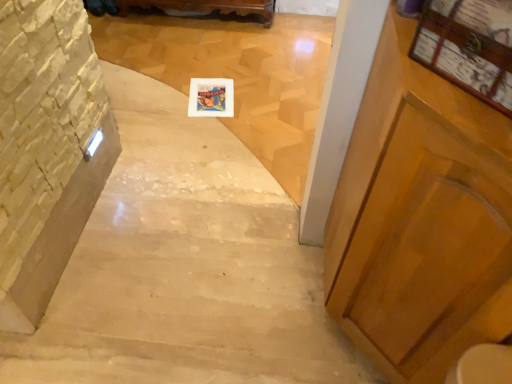
Question: From the image's perspective, is wooden carved bench at upper center below wooden frame at upper right?

Choices:
 (A) no
 (B) yes

Answer: (A)

Question: Is wooden carved bench at upper center smaller than wooden frame at upper right?

Choices:
 (A) no
 (B) yes

Answer: (A)

Question: Is wooden carved bench at upper center positioned in front of wooden frame at upper right?

Choices:
 (A) no
 (B) yes

Answer: (A)

Question: Can you confirm if wooden carved bench at upper center is wider than wooden frame at upper right?

Choices:
 (A) yes
 (B) no

Answer: (A)

Question: Can you confirm if wooden carved bench at upper center is bigger than wooden frame at upper right?

Choices:
 (A) yes
 (B) no

Answer: (A)

Question: Is wooden carved bench at upper center taller than wooden frame at upper right?

Choices:
 (A) yes
 (B) no

Answer: (A)

Question: Is stone textured wall at left, the 2th stairwell from the right, to the right of wooden carved bench at upper center from the viewer's perspective?

Choices:
 (A) no
 (B) yes

Answer: (A)

Question: Is stone textured wall at left, the 2th stairwell from the right, oriented away from wooden carved bench at upper center?

Choices:
 (A) no
 (B) yes

Answer: (A)

Question: Is stone textured wall at left, the 2th stairwell from the right, directly adjacent to wooden carved bench at upper center?

Choices:
 (A) no
 (B) yes

Answer: (A)

Question: Is stone textured wall at left, the 2th stairwell from the right, not close to wooden carved bench at upper center?

Choices:
 (A) no
 (B) yes

Answer: (B)

Question: Is stone textured wall at left, positioned as the first stairwell in left-to-right order, smaller than wooden carved bench at upper center?

Choices:
 (A) yes
 (B) no

Answer: (A)

Question: Can we say stone textured wall at left, the 2th stairwell from the right, lies outside wooden carved bench at upper center?

Choices:
 (A) no
 (B) yes

Answer: (B)

Question: Is white marble stairs at center, the 1th stairwell in the right-to-left sequence, thinner than wooden frame at center?

Choices:
 (A) yes
 (B) no

Answer: (B)